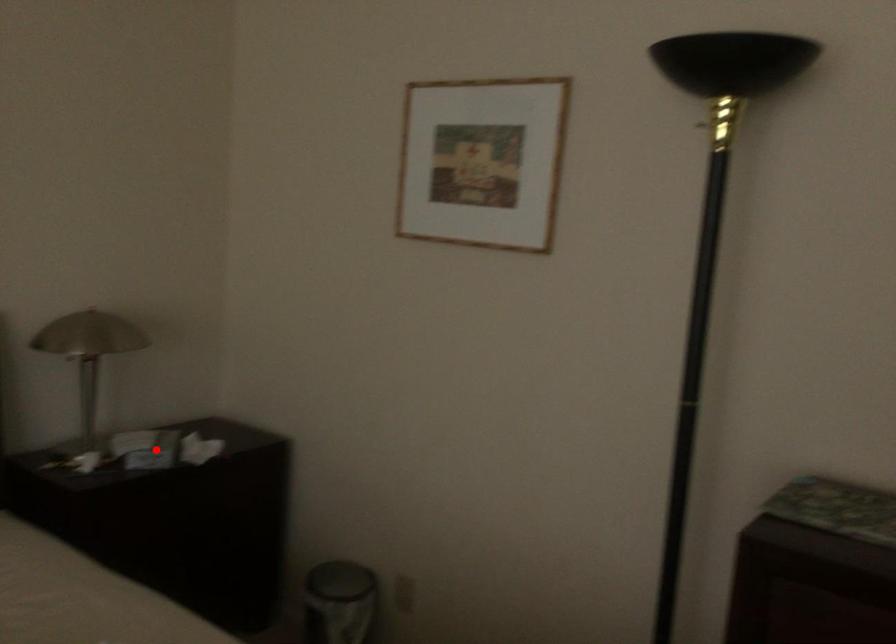
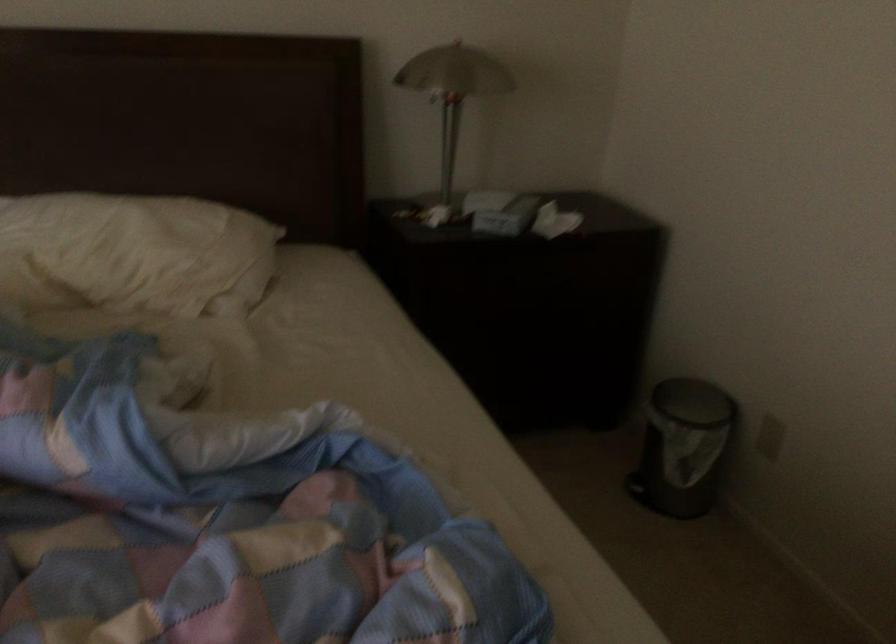
Question: I am providing you with two images of the same scene from different viewpoints. Given a red point in image1, look at the same physical point in image2. Is it:

Choices:
 (A) Closer to the viewpoint
 (B) Farther from the viewpoint

Answer: (A)